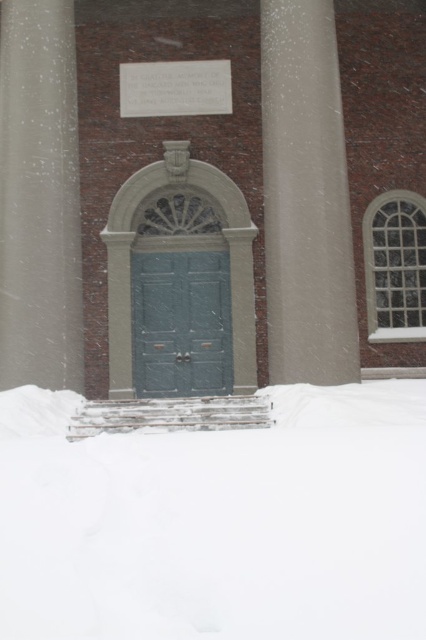
You are an architect designing a new building inspired by this structure. You need to ensure the pillars on both sides of the entrance are proportional. Given the smooth concrete pillar at right and the smooth concrete pillar at left, which pillar has a greater width?

The smooth concrete pillar at left has a greater width than the smooth concrete pillar at right according to the description.

You are a delivery person trying to navigate through the green matte door at center. There is a smooth concrete pillar at right nearby. Considering their sizes, which one would require more space to maneuver around?

The smooth concrete pillar at right is larger in size than the green matte door at center, so it would require more space to maneuver around.

You are standing at the entrance of the building and want to place a small potted plant on the ground near the white fluffy snow at lower center. Based on the coordinates provided, where exactly should you place the plant?

The white fluffy snow at lower center is located at coordinates point (218, 522), so you should place the plant near that point.